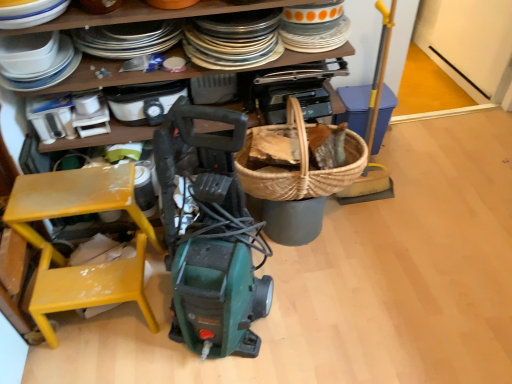
Locate an element on the screen. This screenshot has height=384, width=512. unoccupied area in front of yellow painted wood chair at lower left is located at coordinates (108, 364).